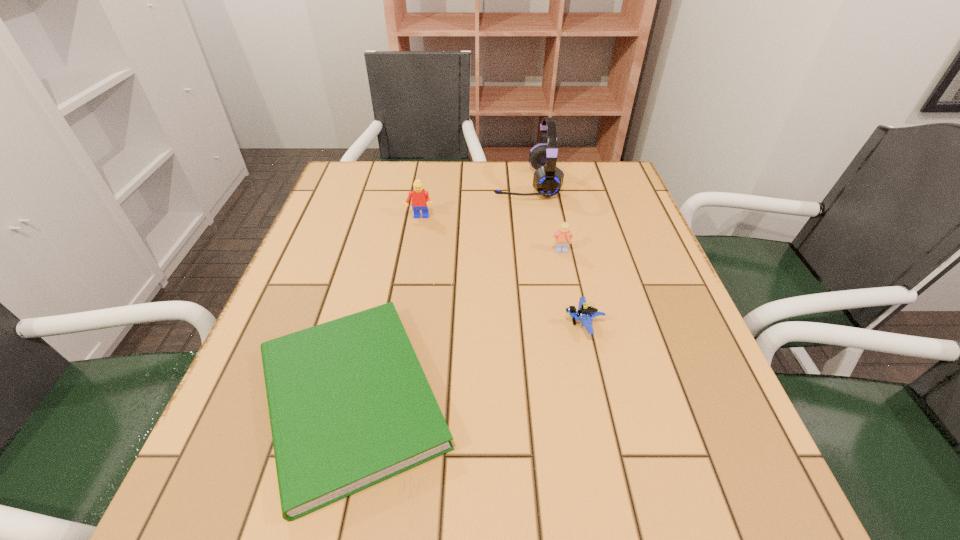
Identify the location of free space located on the ear cushions of the tallest object. This screenshot has width=960, height=540. (462, 183).

What are the coordinates of `free space located 0.280m on the ear cushions of the tallest object` in the screenshot? It's located at (396, 183).

At what (x,y) coordinates should I click in order to perform the action: click on free spot located on the front-facing side of the farthest Lego. Please return your answer as a coordinate pair (x, y). This screenshot has width=960, height=540. Looking at the image, I should click on (415, 246).

I want to click on vacant area located 0.250m on the front-facing side of the second shortest Lego, so click(x=579, y=336).

At what (x,y) coordinates should I click in order to perform the action: click on vacant region located on the front-facing side of the second shortest object. Please return your answer as a coordinate pair (x, y). The width and height of the screenshot is (960, 540). Looking at the image, I should click on (384, 324).

This screenshot has width=960, height=540. I want to click on vacant area situated 0.190m on the front-facing side of the second shortest object, so click(468, 324).

I want to click on vacant space situated on the front-facing side of the second shortest object, so click(x=369, y=324).

Image resolution: width=960 pixels, height=540 pixels. What are the coordinates of `vacant space located on the back of the paperback book` in the screenshot? It's located at (378, 287).

Locate an element on the screen. object at the far edge is located at coordinates (548, 179).

Identify the location of object positioned at the near edge. (349, 404).